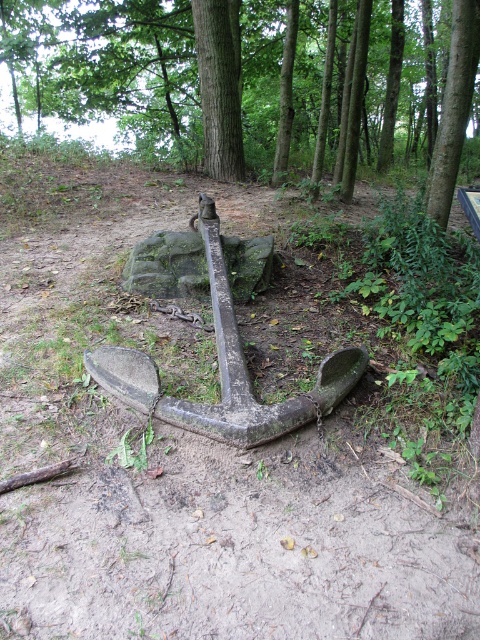
Question: Among these objects, which one is farthest from the camera?

Choices:
 (A) green mossy rock at center
 (B) green rough bark tree at center

Answer: (B)

Question: From the image, what is the correct spatial relationship of green rough bark tree at center in relation to green mossy rock at center?

Choices:
 (A) right
 (B) left

Answer: (A)

Question: Does green rough bark tree at center have a lesser width compared to green mossy rock at center?

Choices:
 (A) yes
 (B) no

Answer: (A)

Question: Can you confirm if green rough bark tree at center is smaller than green mossy rock at center?

Choices:
 (A) yes
 (B) no

Answer: (A)